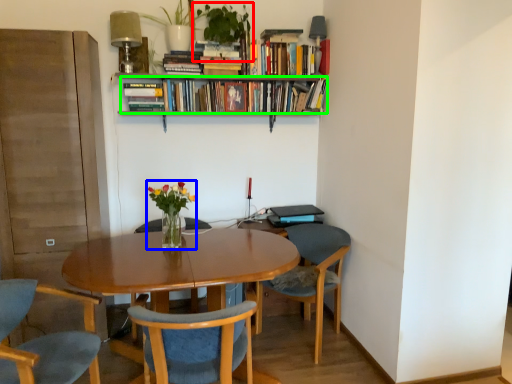
Question: Based on their relative distances, which object is farther from houseplant (highlighted by a red box)? Choose from floral arrangement (highlighted by a blue box) and book (highlighted by a green box).

Choices:
 (A) floral arrangement
 (B) book

Answer: (A)